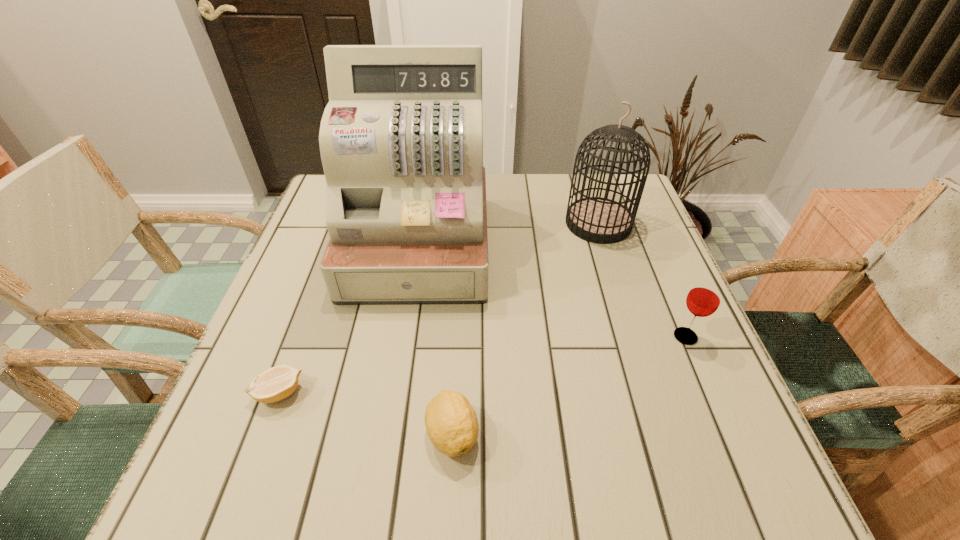
Find the location of a particular element. The image size is (960, 540). free spot between the tallest object and the shorter lemon is located at coordinates click(x=348, y=319).

Find the location of `free spot between the third farthest object and the tallest object`. free spot between the third farthest object and the tallest object is located at coordinates (552, 291).

Locate an element on the screen. Image resolution: width=960 pixels, height=540 pixels. unoccupied area between the third tallest object and the taller lemon is located at coordinates (569, 385).

Locate an element on the screen. empty location between the third shortest object and the birdcage is located at coordinates (641, 280).

Where is `free space between the second shortest object and the tallest object`? This screenshot has width=960, height=540. free space between the second shortest object and the tallest object is located at coordinates (435, 340).

Find the location of a particular element. The image size is (960, 540). free space between the shortest object and the taller lemon is located at coordinates (366, 413).

Where is `free space between the taller lemon and the left lemon`? The image size is (960, 540). free space between the taller lemon and the left lemon is located at coordinates (366, 413).

This screenshot has width=960, height=540. Find the location of `object identified as the fourth closest to the cash register`. object identified as the fourth closest to the cash register is located at coordinates (704, 298).

Where is `the fourth closest object to the right lemon`? The width and height of the screenshot is (960, 540). the fourth closest object to the right lemon is located at coordinates (599, 220).